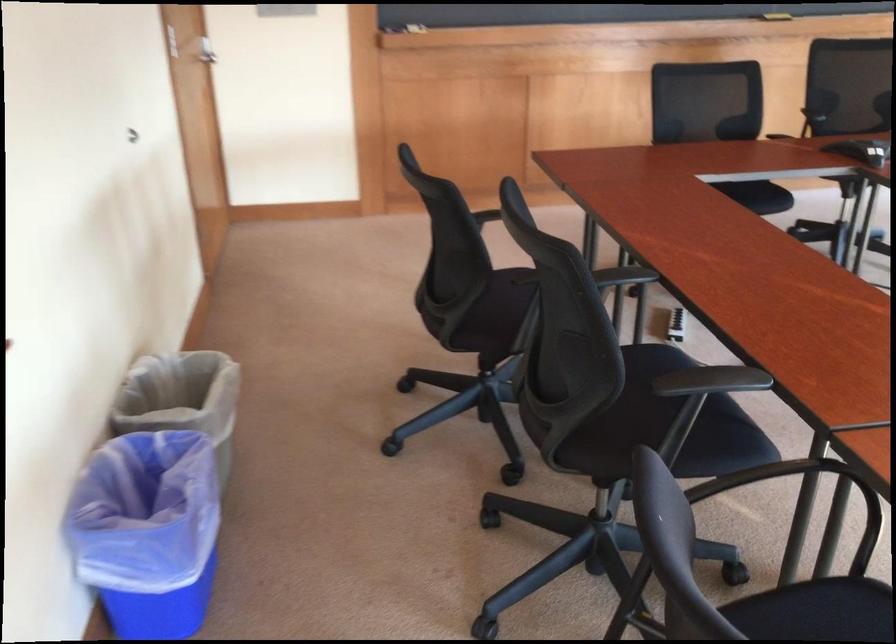
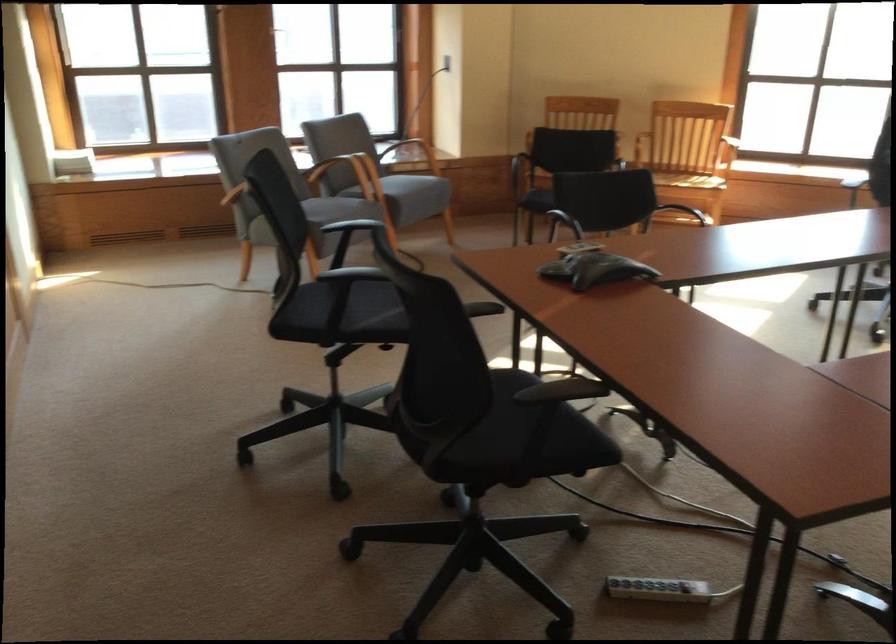
Where in the second image is the point corresponding to [655,313] from the first image?

(657, 589)